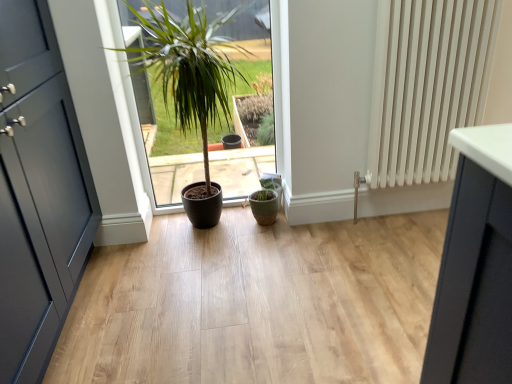
Find the location of a particular element. vacant region to the right of matte brown pot at center is located at coordinates (303, 242).